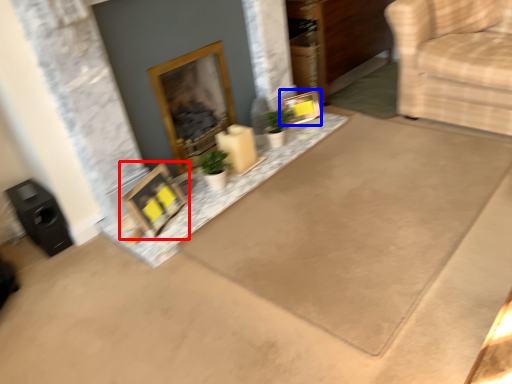
Question: Which of the following is the farthest to the observer, picture frame (highlighted by a red box) or picture frame (highlighted by a blue box)?

Choices:
 (A) picture frame
 (B) picture frame

Answer: (B)